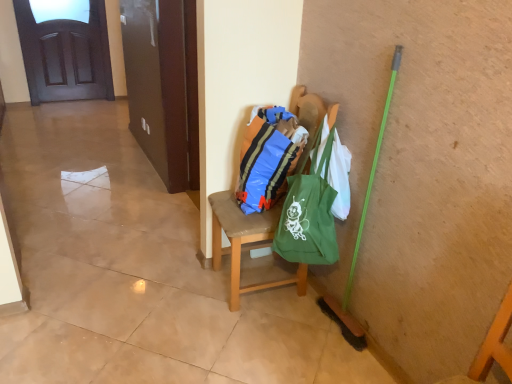
You are a GUI agent. You are given a task and a screenshot of the screen. Output one action in this format:
    pyautogui.click(x=<x>, y=<y>)
    Task: Click on the free space to the left of green fabric bag at center
    
    Given the screenshot: What is the action you would take?
    pyautogui.click(x=180, y=297)